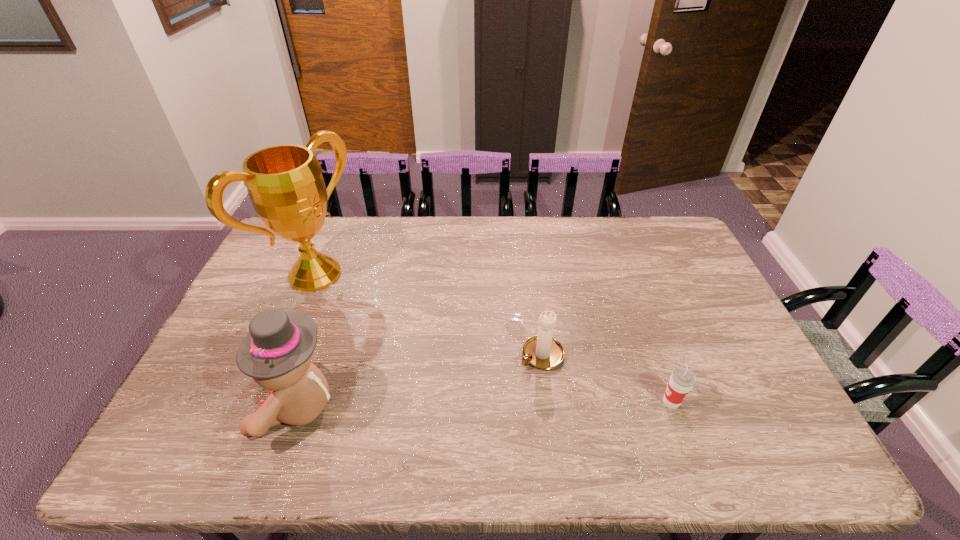
Find the location of a particular element. The height and width of the screenshot is (540, 960). vacant space in between the farthest object and the shortest object is located at coordinates (493, 339).

Locate an element on the screen. vacant space that's between the cup and the rag_doll is located at coordinates click(x=484, y=404).

The image size is (960, 540). What are the coordinates of `unoccupied position between the rightmost object and the farthest object` in the screenshot? It's located at (493, 339).

At what (x,y) coordinates should I click in order to perform the action: click on vacant region between the second object from right to left and the second tallest object. Please return your answer as a coordinate pair (x, y). Image resolution: width=960 pixels, height=540 pixels. Looking at the image, I should click on (419, 381).

Find the location of a particular element. This screenshot has height=540, width=960. vacant area that lies between the second tallest object and the cup is located at coordinates tap(484, 404).

The height and width of the screenshot is (540, 960). Find the location of `unoccupied area between the second object from right to left and the shortest object`. unoccupied area between the second object from right to left and the shortest object is located at coordinates (607, 379).

Identify the location of free space between the rightmost object and the third object from left to right. (607, 379).

Where is `the second closest object relative to the third shortest object`? The height and width of the screenshot is (540, 960). the second closest object relative to the third shortest object is located at coordinates [543, 352].

Where is `object that is the closest one to the cup`? object that is the closest one to the cup is located at coordinates (543, 352).

You are a GUI agent. You are given a task and a screenshot of the screen. Output one action in this format:
    pyautogui.click(x=<x>, y=<y>)
    Task: Click on the free space that satisfies the following two spatial constraints: 1. on the front side of the rag_doll; 2. on the front-facing side of the tallest object
    This screenshot has height=540, width=960.
    Given the screenshot: What is the action you would take?
    pyautogui.click(x=260, y=407)